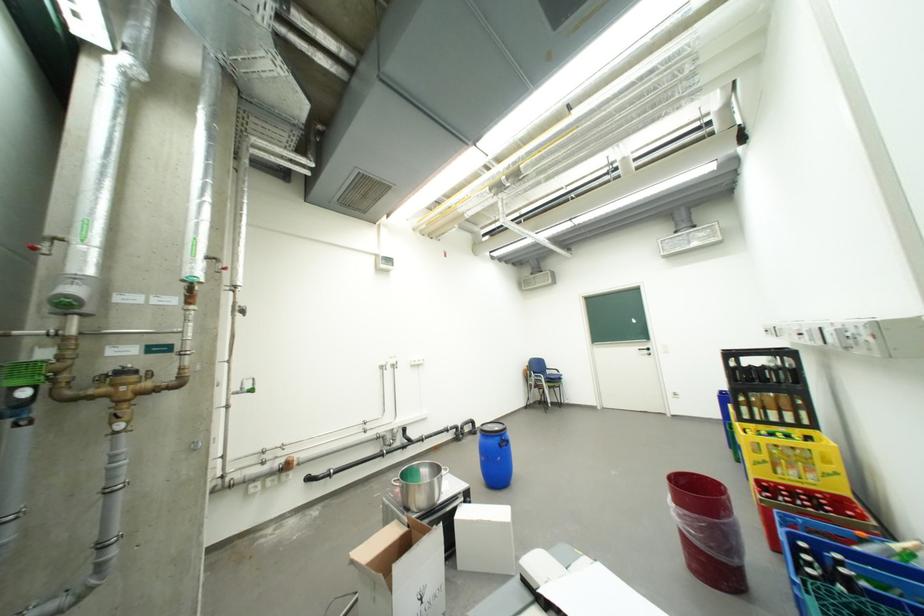
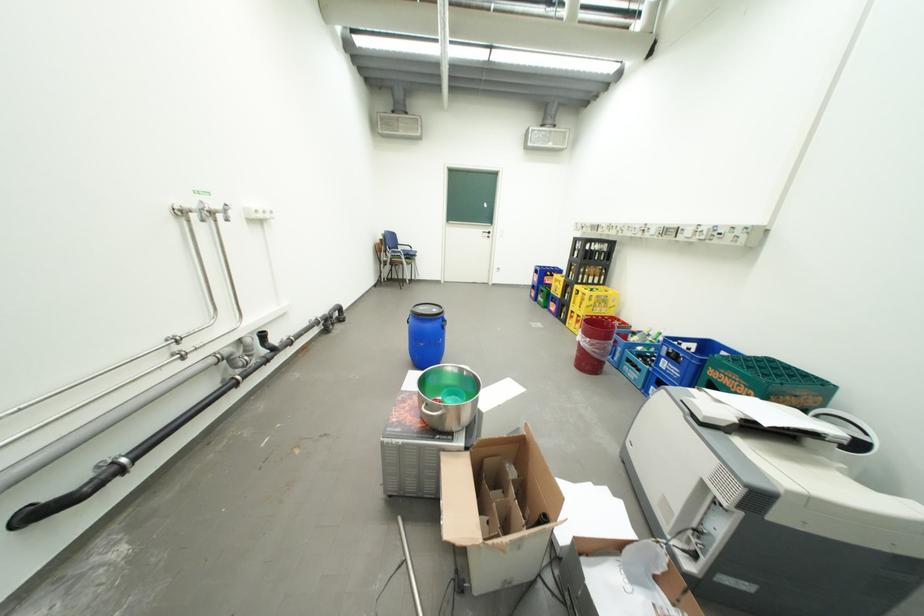
The point at [685,507] is marked in the first image. Where is the corresponding point in the second image?

(599, 341)